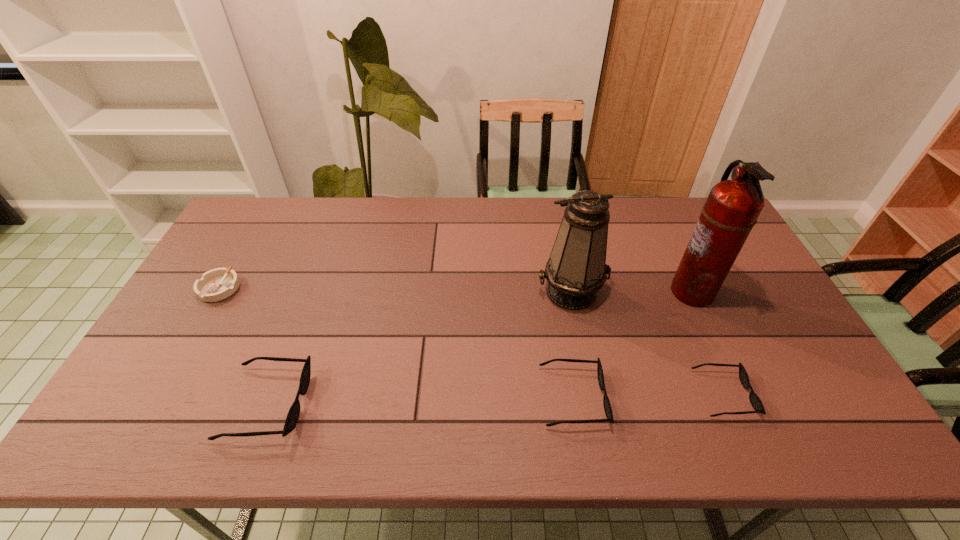
In order to click on vacant space located on the front-facing side of the rightmost sunglasses in this screenshot , I will do `click(793, 394)`.

The image size is (960, 540). I want to click on free space located on the right of the oil lamp, so click(670, 292).

Identify the location of free space located 0.270m on the side of the tallest object with the handle and hose. This screenshot has height=540, width=960. (580, 291).

Find the location of `vacant area located 0.190m on the side of the tallest object with the handle and hose`. vacant area located 0.190m on the side of the tallest object with the handle and hose is located at coordinates (607, 291).

Locate an element on the screen. free region located on the side of the tallest object with the handle and hose is located at coordinates (640, 291).

Identify the location of free spot located 0.180m on the back of the leftmost object. (250, 236).

At what (x,y) coordinates should I click in order to perform the action: click on object located in the left edge section of the desktop. Please return your answer as a coordinate pair (x, y). This screenshot has height=540, width=960. Looking at the image, I should click on (217, 284).

This screenshot has height=540, width=960. I want to click on object located in the right edge section of the desktop, so click(x=732, y=208).

In order to click on free space at the far edge of the desktop in this screenshot , I will do `click(357, 225)`.

You are a GUI agent. You are given a task and a screenshot of the screen. Output one action in this format:
    pyautogui.click(x=<x>, y=<y>)
    Task: Click on the vacant region at the near edge of the desktop
    Image resolution: width=960 pixels, height=540 pixels.
    Given the screenshot: What is the action you would take?
    pyautogui.click(x=623, y=388)